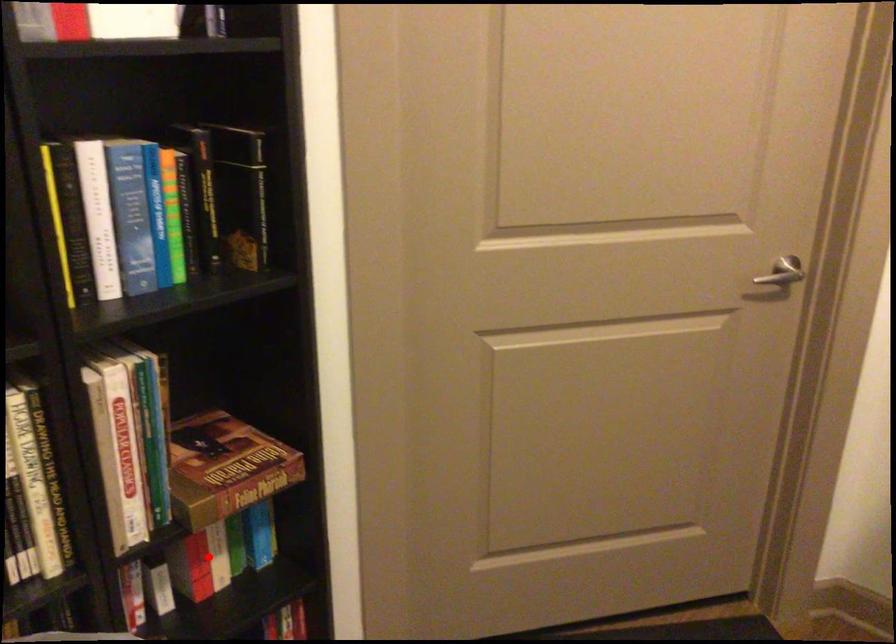
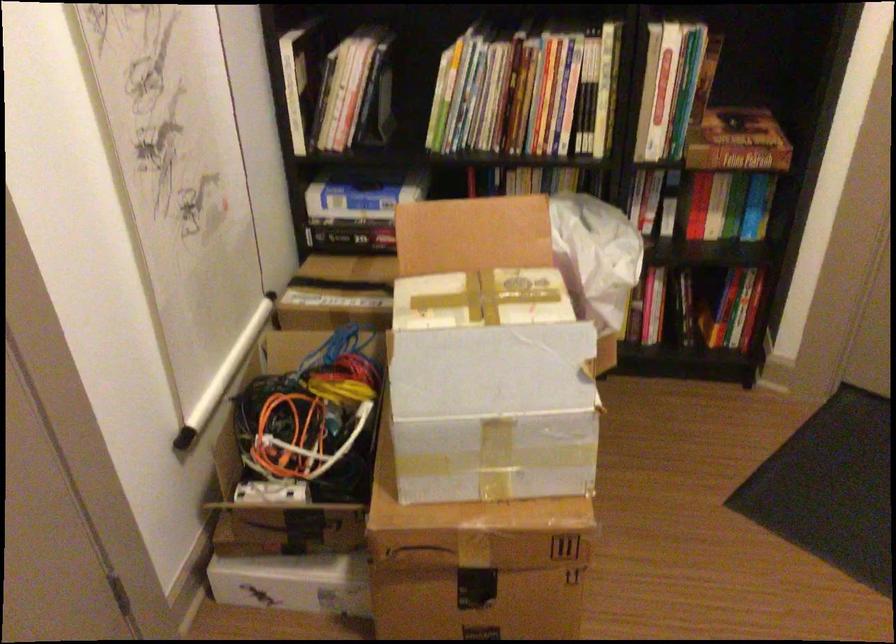
Question: I am providing you with two images of the same scene from different viewpoints. Given a red point in image1, look at the same physical point in image2. Is it:

Choices:
 (A) Closer to the viewpoint
 (B) Farther from the viewpoint

Answer: (B)